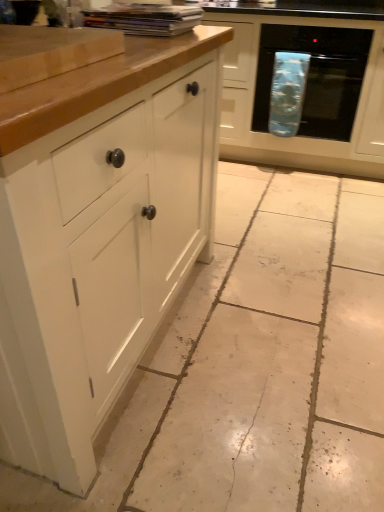
Question: Would you say matte white cabinet at center, the 1th cabinetry positioned from the right, is inside or outside white tile floor at center?

Choices:
 (A) inside
 (B) outside

Answer: (B)

Question: In terms of height, does matte white cabinet at center, the second cabinetry viewed from the left, look taller or shorter compared to white tile floor at center?

Choices:
 (A) tall
 (B) short

Answer: (A)

Question: Which is nearer to the white tile floor at center?

Choices:
 (A) white matte cabinet at left, the second cabinetry viewed from the right
 (B) blue fabric oven at right
 (C) matte white cabinet at center, the 1th cabinetry positioned from the right

Answer: (A)

Question: Considering the real-world distances, which object is farthest from the white tile floor at center?

Choices:
 (A) white matte cabinet at left, the second cabinetry viewed from the right
 (B) blue fabric oven at right
 (C) matte white cabinet at center, marked as the second cabinetry in a front-to-back arrangement

Answer: (B)